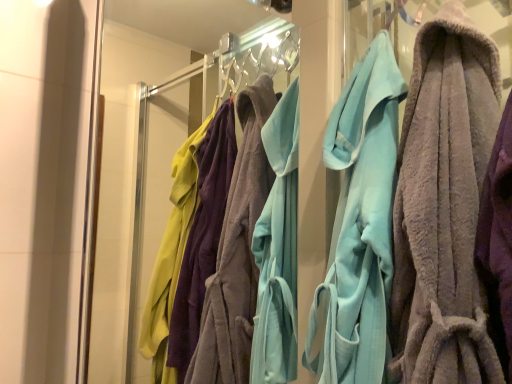
Question: Considering the relative sizes of soft gray towel at center, marked as the 1th towel in a front-to-back arrangement, and transparent glass door at center in the image provided, is soft gray towel at center, marked as the 1th towel in a front-to-back arrangement, shorter than transparent glass door at center?

Choices:
 (A) yes
 (B) no

Answer: (A)

Question: Does soft gray towel at center, marked as the 1th towel in a front-to-back arrangement, have a smaller size compared to transparent glass door at center?

Choices:
 (A) no
 (B) yes

Answer: (B)

Question: Is soft gray towel at center, marked as the second towel in a back-to-front arrangement, next to transparent glass door at center?

Choices:
 (A) yes
 (B) no

Answer: (B)

Question: Can you confirm if soft gray towel at center, marked as the second towel in a back-to-front arrangement, is positioned to the left of transparent glass door at center?

Choices:
 (A) no
 (B) yes

Answer: (A)

Question: From the image's perspective, is soft gray towel at center, marked as the 1th towel in a front-to-back arrangement, beneath transparent glass door at center?

Choices:
 (A) yes
 (B) no

Answer: (B)

Question: Is soft gray towel at center, marked as the second towel in a back-to-front arrangement, facing towards transparent glass door at center?

Choices:
 (A) yes
 (B) no

Answer: (B)

Question: Is light blue plush robe at center, acting as the 2th towel starting from the front, surrounded by transparent glass door at center?

Choices:
 (A) no
 (B) yes

Answer: (A)

Question: Can you confirm if transparent glass door at center is positioned to the right of light blue plush robe at center, acting as the 2th towel starting from the front?

Choices:
 (A) no
 (B) yes

Answer: (A)

Question: Is transparent glass door at center thinner than light blue plush robe at center, acting as the 2th towel starting from the front?

Choices:
 (A) yes
 (B) no

Answer: (A)

Question: Is transparent glass door at center shorter than light blue plush robe at center, arranged as the first towel when viewed from the back?

Choices:
 (A) no
 (B) yes

Answer: (B)

Question: Considering the relative positions of transparent glass door at center and light blue plush robe at center, arranged as the first towel when viewed from the back, in the image provided, is transparent glass door at center to the left of light blue plush robe at center, arranged as the first towel when viewed from the back, from the viewer's perspective?

Choices:
 (A) yes
 (B) no

Answer: (A)

Question: Considering the relative positions of transparent glass door at center and light blue plush robe at center, arranged as the first towel when viewed from the back, in the image provided, is transparent glass door at center in front of light blue plush robe at center, arranged as the first towel when viewed from the back,?

Choices:
 (A) no
 (B) yes

Answer: (B)

Question: Is soft gray towel at center, marked as the second towel in a back-to-front arrangement, completely or partially inside light blue plush robe at center, arranged as the first towel when viewed from the back?

Choices:
 (A) no
 (B) yes

Answer: (A)